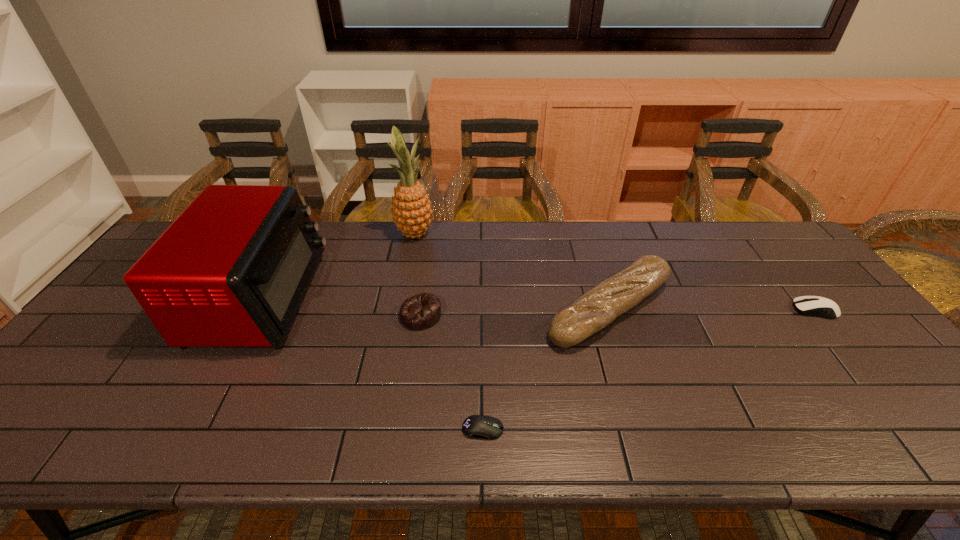
You are a GUI agent. You are given a task and a screenshot of the screen. Output one action in this format:
    pyautogui.click(x=<x>, y=<y>)
    Task: Click on the pineapple
    The width and height of the screenshot is (960, 540).
    Given the screenshot: What is the action you would take?
    pyautogui.click(x=411, y=208)

The width and height of the screenshot is (960, 540). I want to click on the tallest object, so click(411, 208).

At what (x,y) coordinates should I click in order to perform the action: click on toaster oven. Please return your answer as a coordinate pair (x, y). Looking at the image, I should click on (232, 270).

The height and width of the screenshot is (540, 960). In order to click on the fifth shortest object in this screenshot , I will do `click(232, 270)`.

Locate an element on the screen. The image size is (960, 540). the fourth shortest object is located at coordinates (594, 310).

Identify the location of baguet. The width and height of the screenshot is (960, 540). (594, 310).

This screenshot has height=540, width=960. Identify the location of beanbag. (422, 311).

This screenshot has width=960, height=540. Identify the location of the taller computer equipment. (817, 306).

The height and width of the screenshot is (540, 960). What are the coordinates of `the right computer equipment` in the screenshot? It's located at (817, 306).

Locate an element on the screen. the shorter computer equipment is located at coordinates (475, 426).